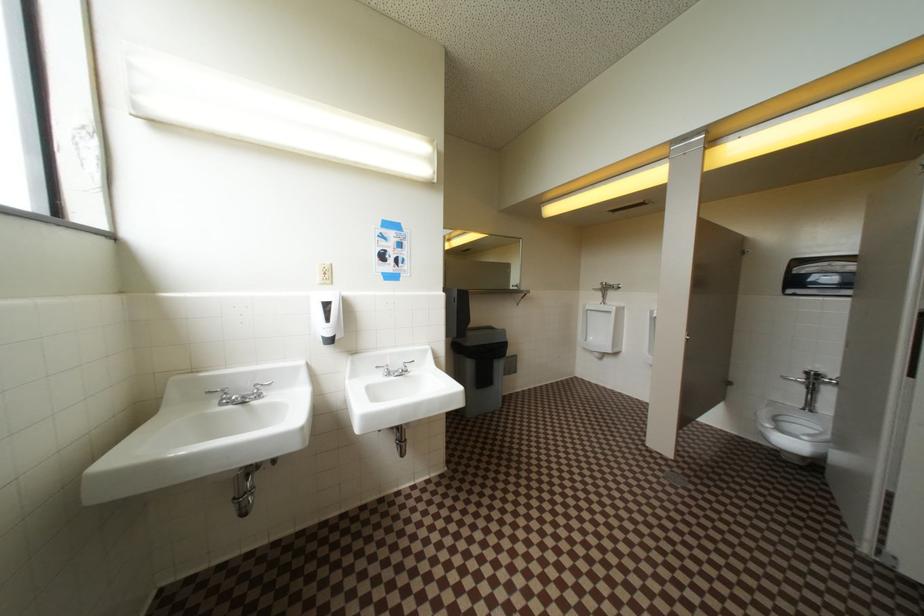
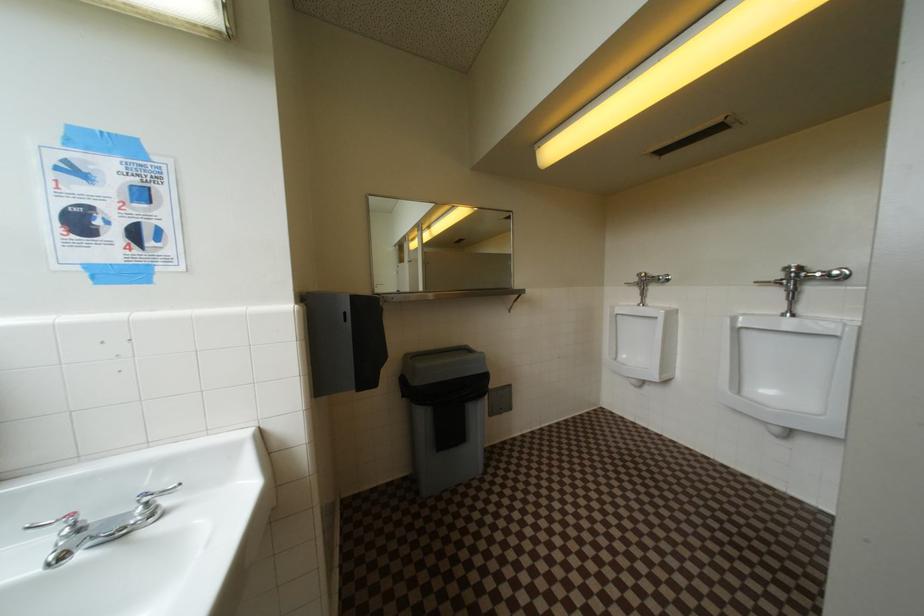
In a continuous first-person perspective shot, in which direction is the camera moving?

The cameraman moved toward right, forward.